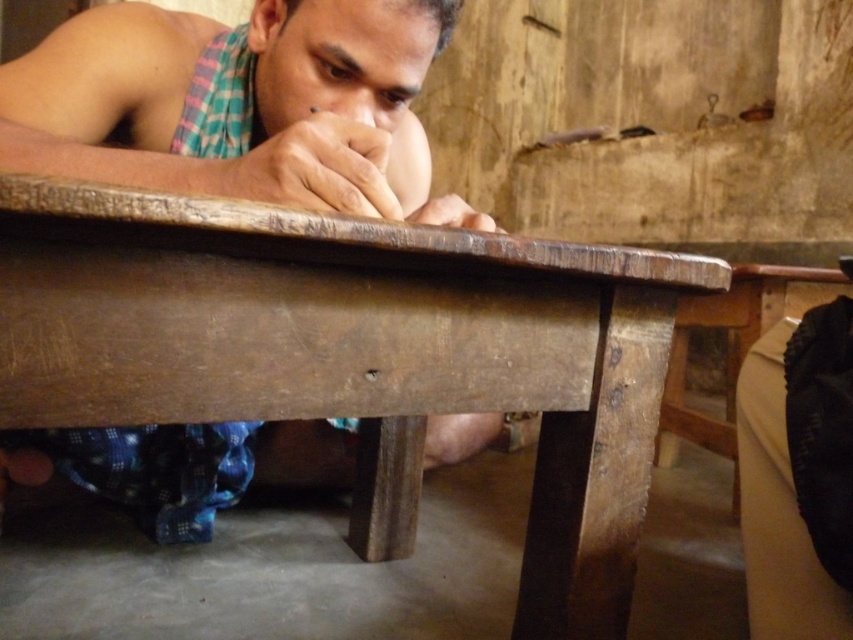
Question: Which point appears closest to the camera in this image?

Choices:
 (A) (201, 172)
 (B) (442, 195)

Answer: (A)

Question: Which object is positioned farthest from the rough wooden table at center?

Choices:
 (A) matte brown finger at center
 (B) matte wooden hand at center
 (C) wooden table at center
 (D) black fabric bag at lower right

Answer: (D)

Question: Can you confirm if rough wooden table at center is smaller than matte brown finger at center?

Choices:
 (A) yes
 (B) no

Answer: (B)

Question: Can you confirm if rough wooden table at center is smaller than wooden table at center?

Choices:
 (A) no
 (B) yes

Answer: (B)

Question: Estimate the real-world distances between objects in this image. Which object is closer to the matte wooden hand at center?

Choices:
 (A) rough wooden table at center
 (B) black fabric bag at lower right
 (C) wooden table at center
 (D) matte brown finger at center

Answer: (D)

Question: Is rough wooden table at center thinner than matte brown finger at center?

Choices:
 (A) yes
 (B) no

Answer: (B)